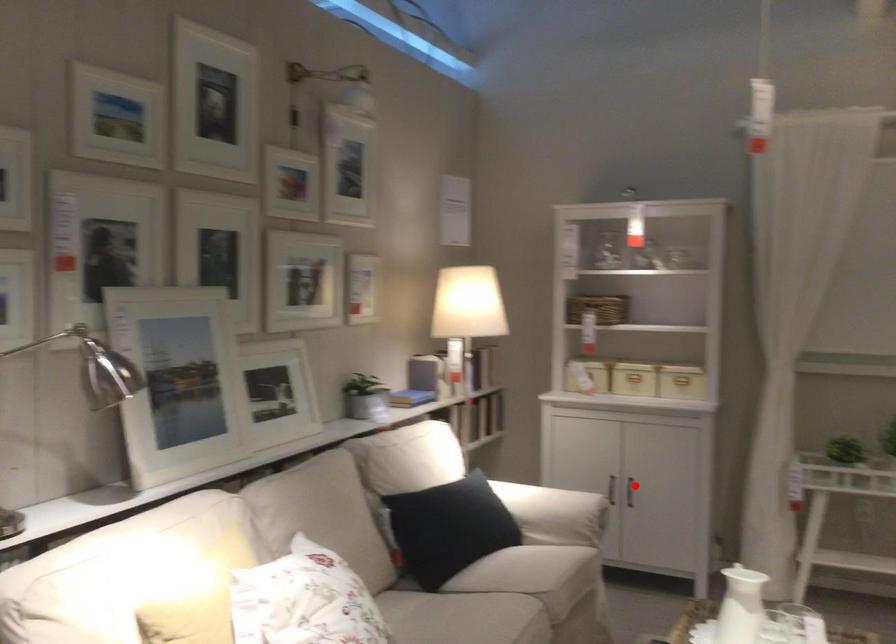
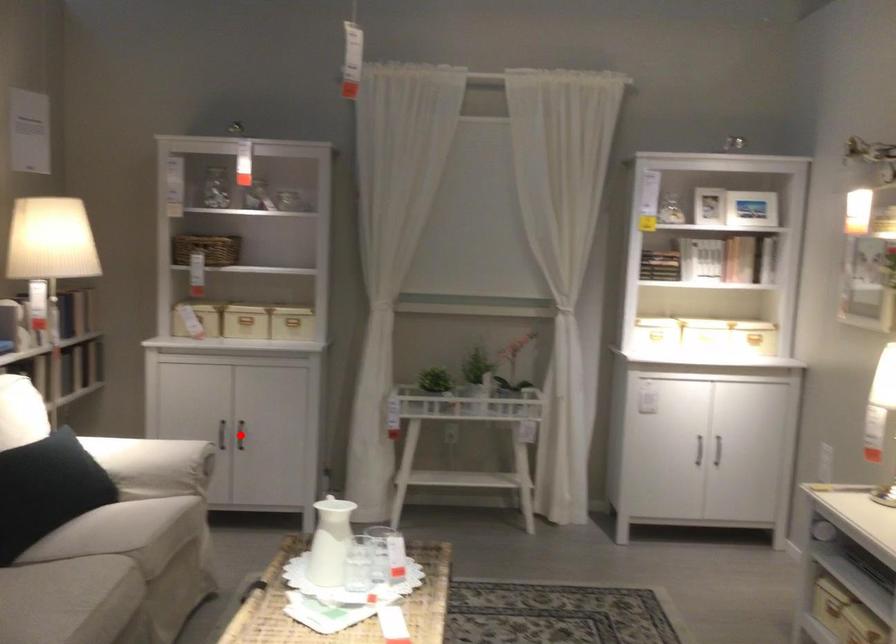
From the picture: I am providing you with two images of the same scene from different viewpoints. A red point is marked on the first image and another point is marked on the second image. Are the points marked in image1 and image2 representing the same 3D position?

Yes